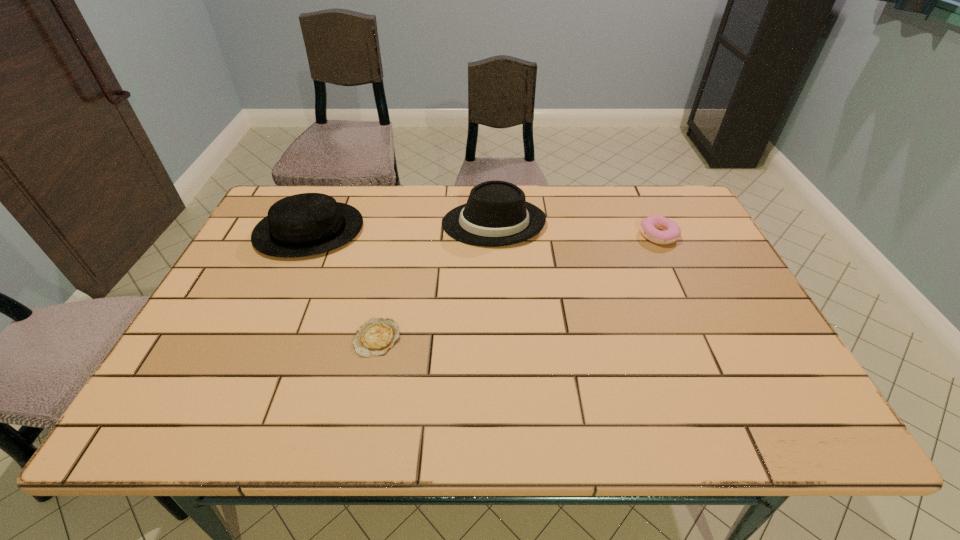
Where is `object that is the second closest to the third tallest object`? Image resolution: width=960 pixels, height=540 pixels. object that is the second closest to the third tallest object is located at coordinates (374, 338).

Locate which object is the second closest to the shorter fedora. Please provide its 2D coordinates. Your answer should be formatted as a tuple, i.e. [(x, y)], where the tuple contains the x and y coordinates of a point satisfying the conditions above.

[(496, 214)]

Identify the location of vacant area that satisfies the following two spatial constraints: 1. on the front-facing side of the pastry; 2. on the left side of the tallest object. The width and height of the screenshot is (960, 540). (494, 235).

Identify the location of blank space that satisfies the following two spatial constraints: 1. on the front-facing side of the right fedora; 2. on the back side of the pastry. (494, 235).

The image size is (960, 540). Identify the location of free spot that satisfies the following two spatial constraints: 1. on the front-facing side of the right fedora; 2. on the front side of the shorter fedora. (493, 231).

Where is `free location that satisfies the following two spatial constraints: 1. on the front side of the third object from right to left; 2. on the left side of the shorter fedora`? This screenshot has height=540, width=960. free location that satisfies the following two spatial constraints: 1. on the front side of the third object from right to left; 2. on the left side of the shorter fedora is located at coordinates (261, 338).